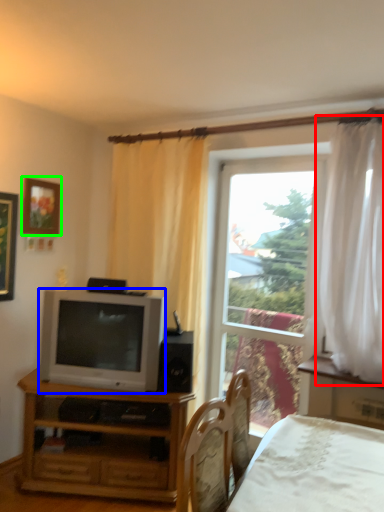
Question: Estimate the real-world distances between objects in this image. Which object is farther from curtain (highlighted by a red box), television (highlighted by a blue box) or picture frame (highlighted by a green box)?

Choices:
 (A) television
 (B) picture frame

Answer: (B)